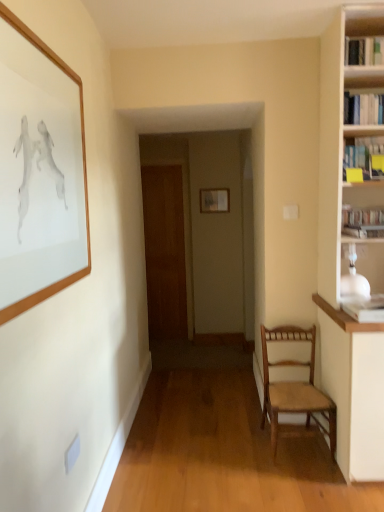
Question: Does hardcover book at right, placed as the fourth book when sorted from top to bottom, appear on the right side of wooden picture frame at upper left, positioned as the 2th picture frame in back-to-front order?

Choices:
 (A) yes
 (B) no

Answer: (A)

Question: Is hardcover book at right, placed as the fourth book when sorted from top to bottom, facing towards wooden picture frame at upper left, the first picture frame viewed from the front?

Choices:
 (A) yes
 (B) no

Answer: (B)

Question: Considering the relative sizes of hardcover book at right, which appears as the 1th book when ordered from the bottom, and wooden picture frame at upper left, the first picture frame viewed from the front, in the image provided, is hardcover book at right, which appears as the 1th book when ordered from the bottom, smaller than wooden picture frame at upper left, the first picture frame viewed from the front,?

Choices:
 (A) yes
 (B) no

Answer: (A)

Question: From a real-world perspective, is hardcover book at right, placed as the fourth book when sorted from top to bottom, located beneath wooden picture frame at upper left, the first picture frame viewed from the front?

Choices:
 (A) yes
 (B) no

Answer: (A)

Question: Is hardcover book at right, placed as the fourth book when sorted from top to bottom, behind wooden picture frame at upper left, placed as the first picture frame when sorted from left to right?

Choices:
 (A) yes
 (B) no

Answer: (A)

Question: Visually, is wooden picture frame at center, which is counted as the first picture frame, starting from the back, positioned to the left or to the right of hardcover book at right, which appears as the 1th book when ordered from the bottom?

Choices:
 (A) left
 (B) right

Answer: (A)

Question: Is wooden picture frame at center, which is counted as the second picture frame, starting from the front, inside or outside of hardcover book at right, placed as the fourth book when sorted from top to bottom?

Choices:
 (A) inside
 (B) outside

Answer: (B)

Question: From a real-world perspective, is wooden picture frame at center, arranged as the second picture frame when viewed from the left, above or below hardcover book at right, which appears as the 1th book when ordered from the bottom?

Choices:
 (A) above
 (B) below

Answer: (A)

Question: Considering the positions of wooden picture frame at center, acting as the 1th picture frame starting from the right, and hardcover book at right, placed as the fourth book when sorted from top to bottom, in the image, is wooden picture frame at center, acting as the 1th picture frame starting from the right, wider or thinner than hardcover book at right, placed as the fourth book when sorted from top to bottom,?

Choices:
 (A) wide
 (B) thin

Answer: (B)

Question: From their relative heights in the image, would you say brown wooden door at center is taller or shorter than wooden picture frame at upper left, placed as the first picture frame when sorted from left to right?

Choices:
 (A) short
 (B) tall

Answer: (B)

Question: Does point (183, 289) appear closer or farther from the camera than point (41, 145)?

Choices:
 (A) farther
 (B) closer

Answer: (A)

Question: Considering their positions, is brown wooden door at center located in front of or behind wooden picture frame at upper left, which is the second picture frame from right to left?

Choices:
 (A) behind
 (B) front

Answer: (A)

Question: Is brown wooden door at center to the left or to the right of wooden picture frame at upper left, positioned as the 2th picture frame in back-to-front order, in the image?

Choices:
 (A) left
 (B) right

Answer: (B)

Question: Considering the positions of wooden picture frame at center, acting as the 1th picture frame starting from the right, and wooden picture frame at upper left, which is the second picture frame from right to left, in the image, is wooden picture frame at center, acting as the 1th picture frame starting from the right, taller or shorter than wooden picture frame at upper left, which is the second picture frame from right to left,?

Choices:
 (A) short
 (B) tall

Answer: (A)

Question: In the image, is wooden picture frame at center, which is counted as the first picture frame, starting from the back, on the left side or the right side of wooden picture frame at upper left, positioned as the 2th picture frame in back-to-front order?

Choices:
 (A) right
 (B) left

Answer: (A)